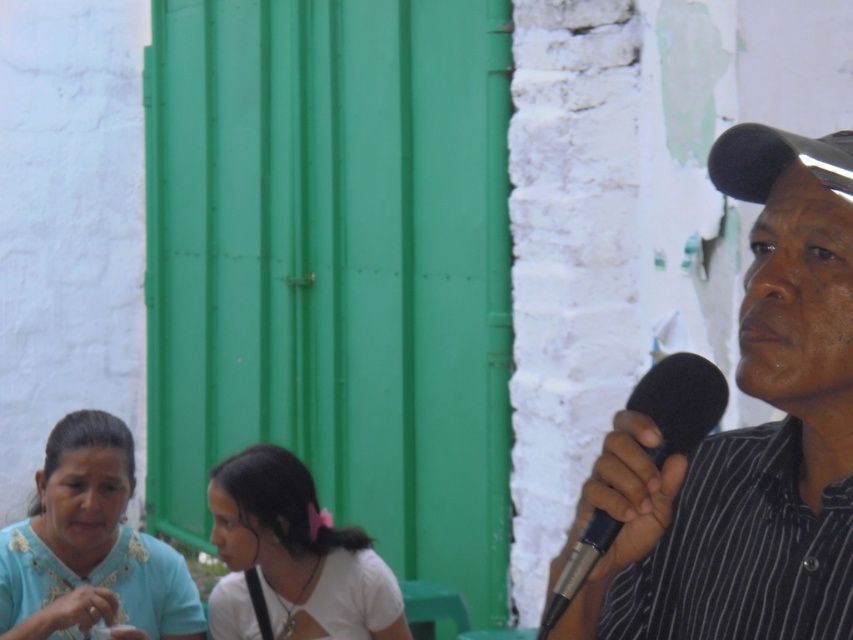
Is black striped shirt at right above black foam microphone at right?

Yes.

Is black striped shirt at right further to camera compared to black foam microphone at right?

Yes, it is.

Between point (730, 188) and point (711, 422), which one is positioned in front?

Point (711, 422) is more forward.

Where is `black striped shirt at right`? The width and height of the screenshot is (853, 640). black striped shirt at right is located at coordinates (747, 436).

Between black striped shirt at right and white matte shirt at center, which one appears on the right side from the viewer's perspective?

From the viewer's perspective, black striped shirt at right appears more on the right side.

Between point (801, 323) and point (219, 636), which one is positioned behind?

Positioned behind is point (219, 636).

At what (x,y) coordinates should I click in order to perform the action: click on black striped shirt at right. Please return your answer as a coordinate pair (x, y). Looking at the image, I should click on pyautogui.click(x=747, y=436).

Can you confirm if white matte shirt at center is positioned above black foam microphone at right?

No, white matte shirt at center is not above black foam microphone at right.

Which is below, white matte shirt at center or black foam microphone at right?

white matte shirt at center

Measure the distance between white matte shirt at center and camera.

white matte shirt at center is 3.91 meters from camera.

The height and width of the screenshot is (640, 853). Identify the location of white matte shirt at center. (293, 556).